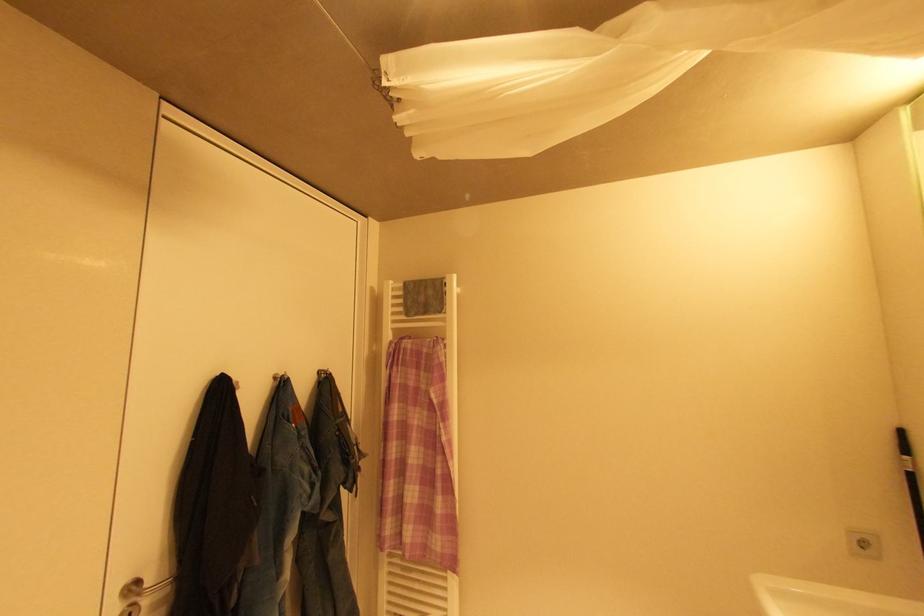
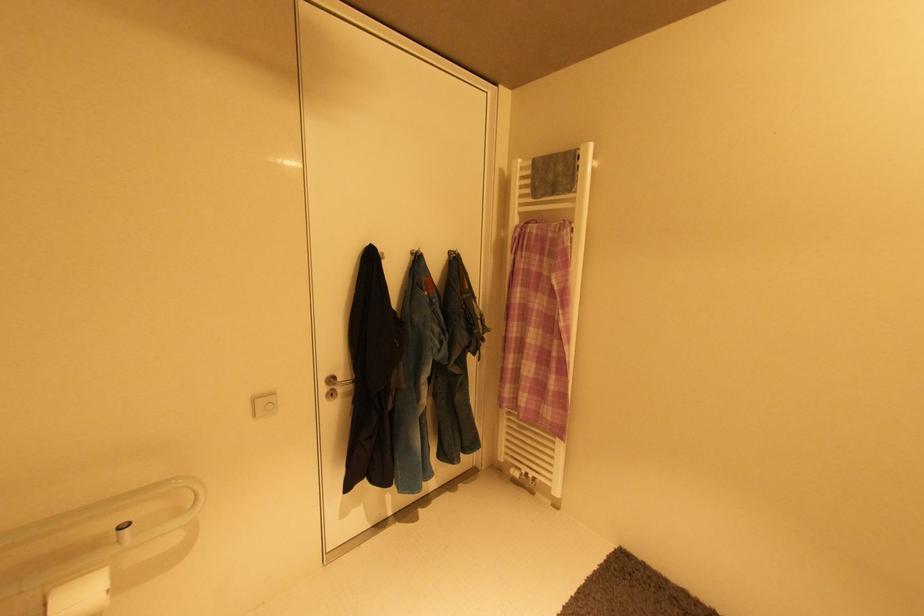
The first image is from the beginning of the video and the second image is from the end. How did the camera likely rotate when shooting the video?

The camera's rotation is toward left-down.